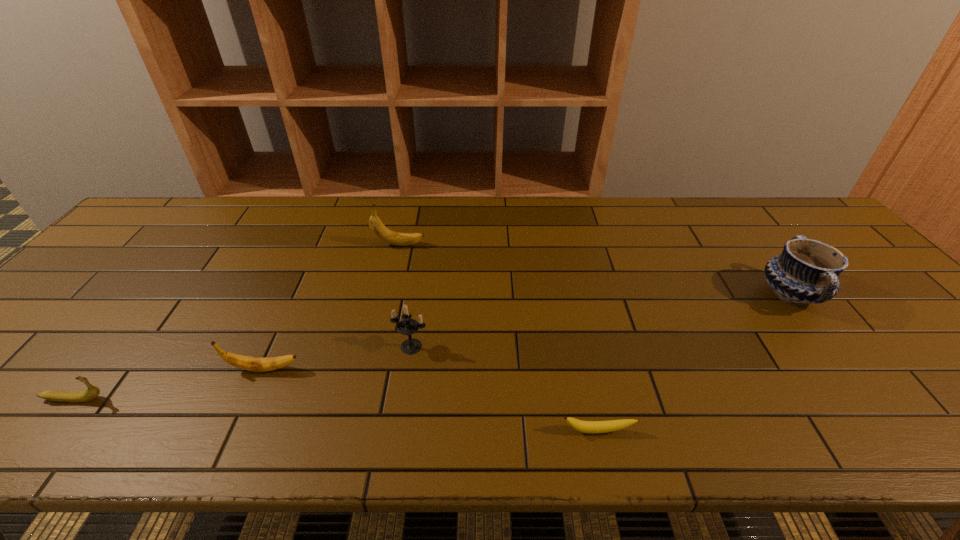
Identify the location of the second closest object to the pottery. (408, 326).

Where is `object that is the fifth closest to the pottery`? This screenshot has height=540, width=960. object that is the fifth closest to the pottery is located at coordinates (92, 392).

At what (x,y) coordinates should I click in order to perform the action: click on banana that is the third closest one to the third farthest object. Please return your answer as a coordinate pair (x, y). The image size is (960, 540). Looking at the image, I should click on (379, 229).

At what (x,y) coordinates should I click in order to perform the action: click on banana that is the fourth nearest to the pottery. Please return your answer as a coordinate pair (x, y). The height and width of the screenshot is (540, 960). Looking at the image, I should click on (92, 392).

You are a GUI agent. You are given a task and a screenshot of the screen. Output one action in this format:
    pyautogui.click(x=<x>, y=<y>)
    Task: Click on the free region that satisfies the following two spatial constraints: 1. on the front side of the fourth nearest object; 2. at the stem of the leftmost object
    
    Given the screenshot: What is the action you would take?
    pyautogui.click(x=403, y=399)

Where is `blank space that satisfies the following two spatial constraints: 1. at the start of the peel on the second banana from right to left; 2. on the left side of the candle holder`? The width and height of the screenshot is (960, 540). blank space that satisfies the following two spatial constraints: 1. at the start of the peel on the second banana from right to left; 2. on the left side of the candle holder is located at coordinates (376, 347).